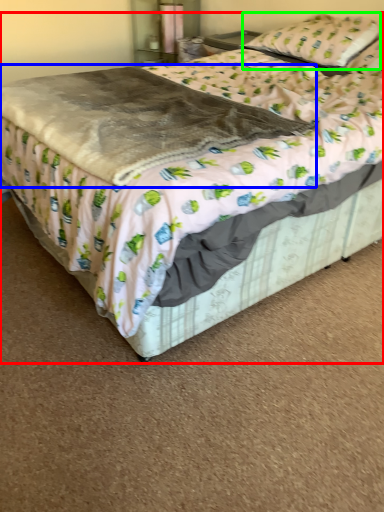
Question: Estimate the real-world distances between objects in this image. Which object is closer to bed (highlighted by a red box), blanket (highlighted by a blue box) or pillow (highlighted by a green box)?

Choices:
 (A) blanket
 (B) pillow

Answer: (A)